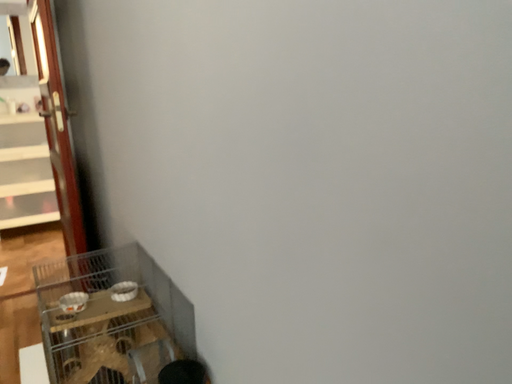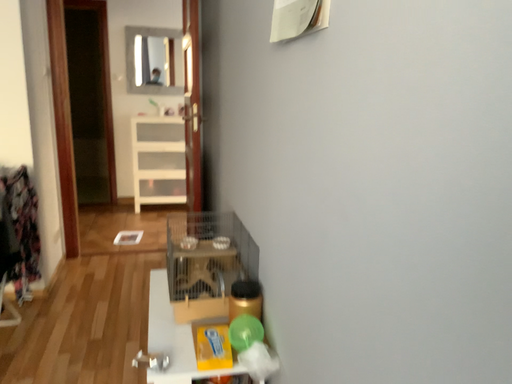
Question: How did the camera likely rotate when shooting the video?

Choices:
 (A) rotated right
 (B) rotated left

Answer: (B)